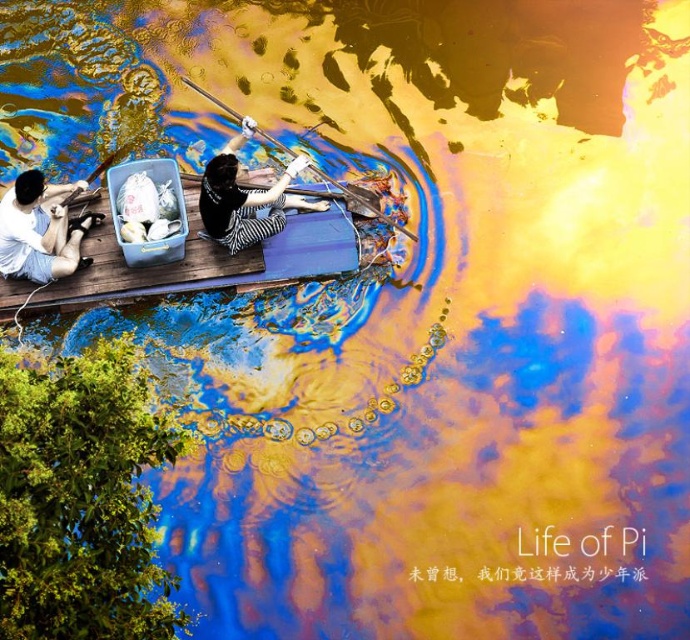
You are standing at the edge of the dock and see the point labeled as point (39, 228). What object is located at that point?

The object at point (39, 228) is the light blue denim shorts at lower left.

You are a photographer trying to capture both the matte black boat at center and the striped fabric woman at center in a single shot. Based on their sizes, which object should you focus on first to ensure proper framing?

The matte black boat at center is smaller than the striped fabric woman at center, so you should focus on the striped fabric woman at center first to ensure proper framing.

You are standing at a point 20 feet away from the dock. You want to reach the point marked as point (69,269). Can you walk straight towards it from your current position?

The distance between point (69,269) and the viewer is 26.94 feet. Since you are currently 20 feet away from the dock, you need to cover an additional 6.94 feet to reach point (69,269). Therefore, you can walk straight towards it if the path is clear.